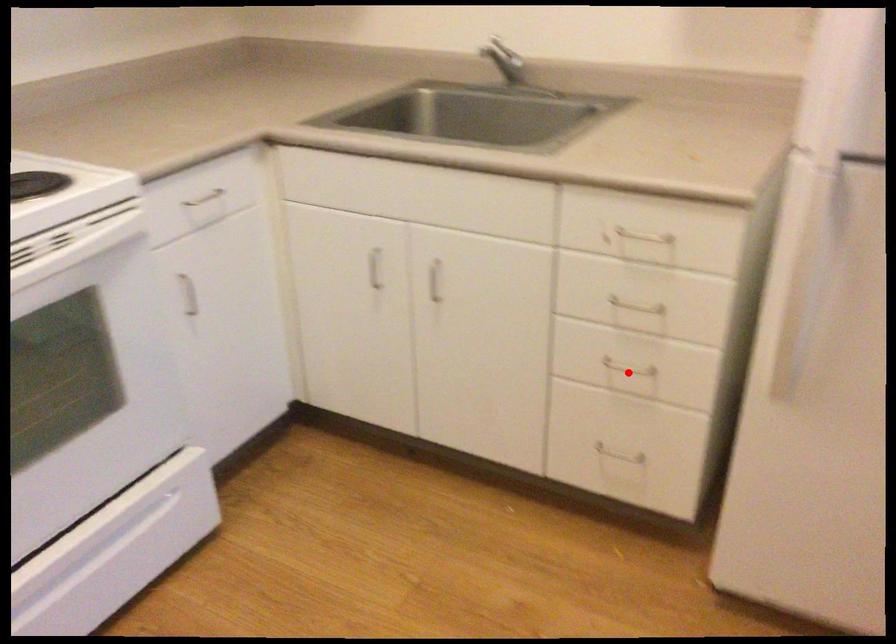
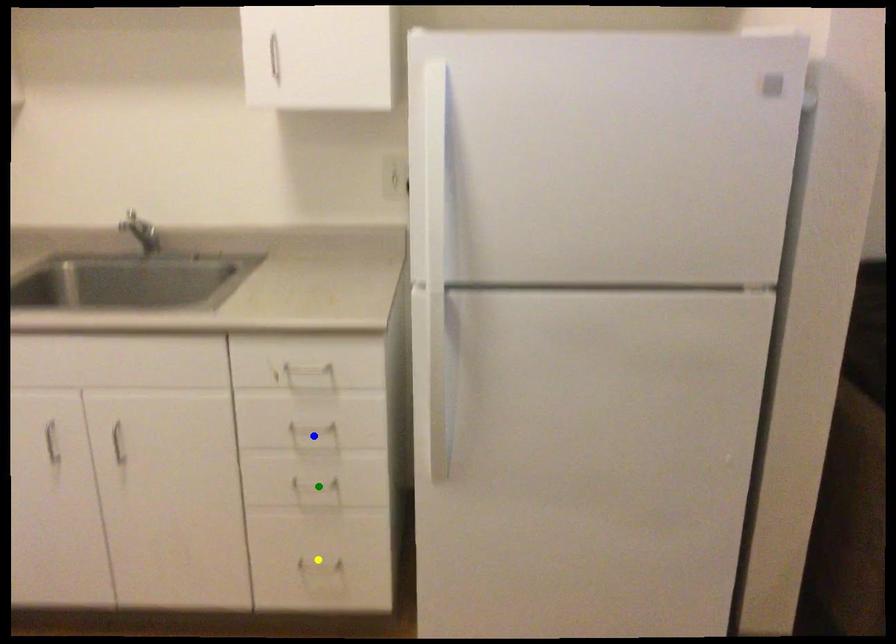
Question: I am providing you with two images of the same scene from different viewpoints. A red point is marked on the first image. You are given multiple points on the second image. Which mark in image 2 goes with the point in image 1?

Choices:
 (A) blue point
 (B) green point
 (C) yellow point

Answer: (B)